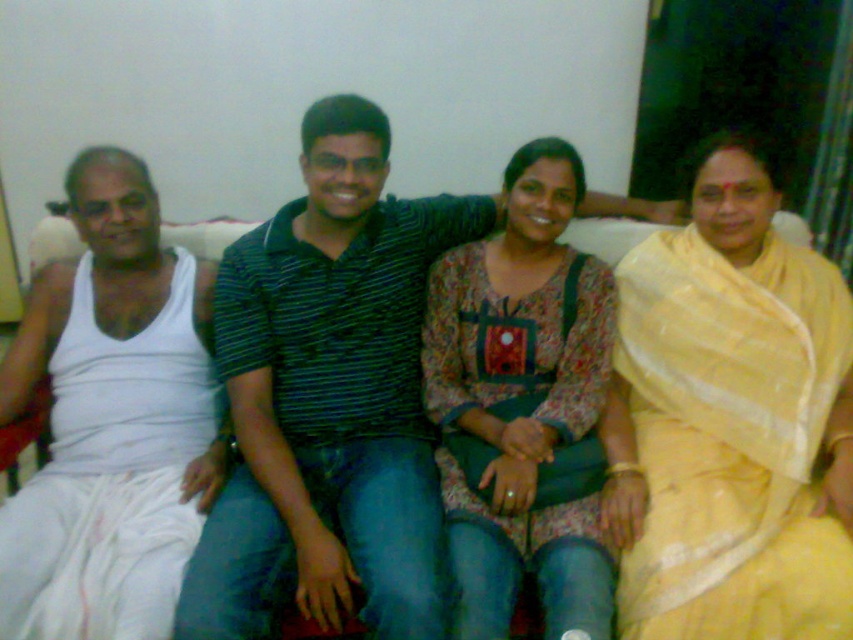
Describe the element at coordinates (730, 420) in the screenshot. I see `yellow silk saree at right` at that location.

Between yellow silk saree at right and white cotton saree at left, which one has more height?

yellow silk saree at right is taller.

Which is behind, point (622, 419) or point (74, 486)?

Point (622, 419)

Locate an element on the screen. This screenshot has width=853, height=640. yellow silk saree at right is located at coordinates (730, 420).

Is yellow silk saree at right below floral-patterned fabric at center?

Yes, yellow silk saree at right is below floral-patterned fabric at center.

Can you confirm if yellow silk saree at right is positioned above floral-patterned fabric at center?

Incorrect, yellow silk saree at right is not positioned above floral-patterned fabric at center.

Where is `yellow silk saree at right`? The image size is (853, 640). yellow silk saree at right is located at coordinates (730, 420).

How much distance is there between white cotton saree at left and floral-patterned fabric at center?

white cotton saree at left and floral-patterned fabric at center are 21.90 inches apart from each other.

In the scene shown: Does white cotton saree at left appear over floral-patterned fabric at center?

Actually, white cotton saree at left is below floral-patterned fabric at center.

Locate an element on the screen. Image resolution: width=853 pixels, height=640 pixels. white cotton saree at left is located at coordinates (111, 420).

At what (x,y) coordinates should I click in order to perform the action: click on white cotton saree at left. Please return your answer as a coordinate pair (x, y). The image size is (853, 640). Looking at the image, I should click on 111,420.